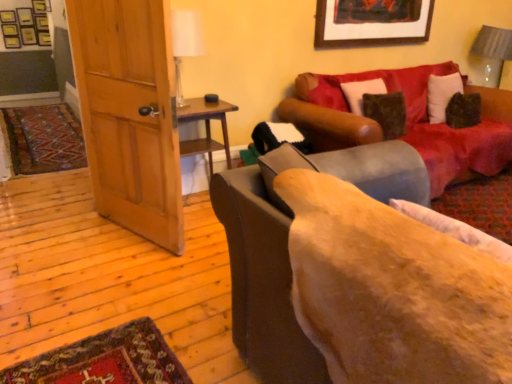
Question: Is wooden picture frame at upper center placed right next to velvet brown couch at center, the first studio couch viewed from the front?

Choices:
 (A) yes
 (B) no

Answer: (B)

Question: Can you confirm if wooden picture frame at upper center is smaller than velvet brown couch at center, the 2th studio couch viewed from the back?

Choices:
 (A) yes
 (B) no

Answer: (A)

Question: Could you tell me if wooden picture frame at upper center is facing velvet brown couch at center, the first studio couch viewed from the front?

Choices:
 (A) yes
 (B) no

Answer: (B)

Question: Is velvet brown couch at center, the first studio couch viewed from the front, inside wooden picture frame at upper center?

Choices:
 (A) yes
 (B) no

Answer: (B)

Question: From a real-world perspective, does wooden picture frame at upper center sit lower than velvet brown couch at center, the first studio couch viewed from the front?

Choices:
 (A) no
 (B) yes

Answer: (A)

Question: Considering the relative positions of velvet red couch at upper right, acting as the first studio couch starting from the back, and wooden picture frame at upper center in the image provided, is velvet red couch at upper right, acting as the first studio couch starting from the back, to the left or to the right of wooden picture frame at upper center?

Choices:
 (A) left
 (B) right

Answer: (B)

Question: In terms of width, does velvet red couch at upper right, acting as the first studio couch starting from the back, look wider or thinner when compared to wooden picture frame at upper center?

Choices:
 (A) wide
 (B) thin

Answer: (A)

Question: Looking at the image, does velvet red couch at upper right, which is counted as the second studio couch, starting from the front, seem bigger or smaller compared to wooden picture frame at upper center?

Choices:
 (A) big
 (B) small

Answer: (A)

Question: Considering their positions, is velvet red couch at upper right, which is counted as the second studio couch, starting from the front, located in front of or behind wooden picture frame at upper center?

Choices:
 (A) behind
 (B) front

Answer: (B)

Question: From the image's perspective, is wooden picture frame at upper center located above or below fluffy beige pillow at lower right?

Choices:
 (A) below
 (B) above

Answer: (B)

Question: Considering the positions of wooden picture frame at upper center and fluffy beige pillow at lower right in the image, is wooden picture frame at upper center wider or thinner than fluffy beige pillow at lower right?

Choices:
 (A) wide
 (B) thin

Answer: (B)

Question: In the image, is wooden picture frame at upper center positioned in front of or behind fluffy beige pillow at lower right?

Choices:
 (A) front
 (B) behind

Answer: (B)

Question: From their relative heights in the image, would you say wooden picture frame at upper center is taller or shorter than fluffy beige pillow at lower right?

Choices:
 (A) tall
 (B) short

Answer: (A)

Question: Considering the positions of velvet red couch at upper right, which is counted as the second studio couch, starting from the front, and gray fabric lampshade at upper right in the image, is velvet red couch at upper right, which is counted as the second studio couch, starting from the front, wider or thinner than gray fabric lampshade at upper right?

Choices:
 (A) thin
 (B) wide

Answer: (B)

Question: Considering the positions of point pyautogui.click(x=292, y=112) and point pyautogui.click(x=509, y=41), is point pyautogui.click(x=292, y=112) closer or farther from the camera than point pyautogui.click(x=509, y=41)?

Choices:
 (A) farther
 (B) closer

Answer: (B)